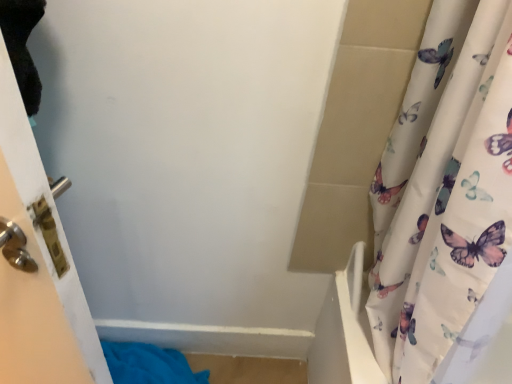
Question: Does blue fabric towel at lower left have a lesser width compared to white glossy door at left?

Choices:
 (A) no
 (B) yes

Answer: (B)

Question: Considering the relative sizes of blue fabric towel at lower left and white glossy door at left in the image provided, is blue fabric towel at lower left smaller than white glossy door at left?

Choices:
 (A) no
 (B) yes

Answer: (B)

Question: Does blue fabric towel at lower left contain white glossy door at left?

Choices:
 (A) yes
 (B) no

Answer: (B)

Question: Are blue fabric towel at lower left and white glossy door at left beside each other?

Choices:
 (A) no
 (B) yes

Answer: (A)

Question: From the image's perspective, is blue fabric towel at lower left below white glossy door at left?

Choices:
 (A) yes
 (B) no

Answer: (A)

Question: Can you confirm if blue fabric towel at lower left is bigger than white glossy door at left?

Choices:
 (A) yes
 (B) no

Answer: (B)

Question: Does white glossy door at left turn towards blue fabric towel at lower left?

Choices:
 (A) no
 (B) yes

Answer: (A)

Question: Is white glossy door at left far away from blue fabric towel at lower left?

Choices:
 (A) yes
 (B) no

Answer: (B)

Question: Does white glossy door at left lie in front of blue fabric towel at lower left?

Choices:
 (A) no
 (B) yes

Answer: (B)

Question: From the image's perspective, is white glossy door at left located above blue fabric towel at lower left?

Choices:
 (A) no
 (B) yes

Answer: (B)

Question: Can you confirm if white glossy door at left is positioned to the right of blue fabric towel at lower left?

Choices:
 (A) yes
 (B) no

Answer: (B)

Question: Can you confirm if white glossy door at left is thinner than blue fabric towel at lower left?

Choices:
 (A) yes
 (B) no

Answer: (B)

Question: From the image's perspective, is white glossy door at left located above or below blue fabric towel at lower left?

Choices:
 (A) below
 (B) above

Answer: (B)